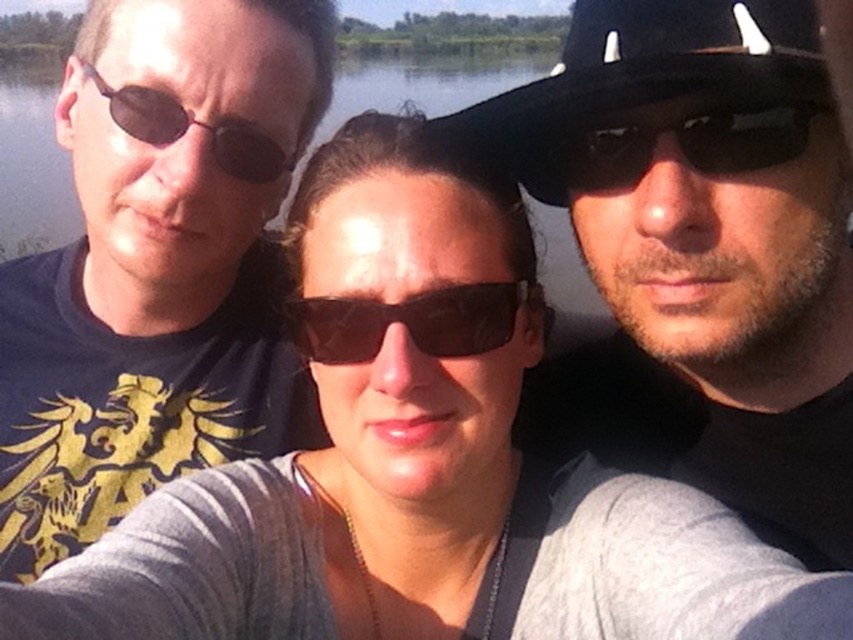
You are trying to take a selfie with your friends by the water. You notice the clear water at upper left and the black matte sunglasses at right in the frame. Which object in the photo takes up more space?

The clear water at upper left takes up more space in the photo because it is bigger than the black matte sunglasses at right.

You are holding a phone and want to take a photo of the matte black hat at upper right and the black matte sunglasses at center. The minimum distance your phone can focus on two objects is 10 inches. Can you capture both objects clearly in the same photo?

The matte black hat at upper right and the black matte sunglasses at center are 10.79 inches apart from each other. Since the minimum focus distance of your phone is 10 inches, which is less than the 10.79 inches between the objects, you can capture both clearly in the same photo.

You are taking a selfie with friends near a lake. You notice the clear water at upper left and the black matte sunglasses at right in your photo. Which object appears higher in the frame?

The clear water at upper left appears higher in the frame than the black matte sunglasses at right because it is positioned above it.